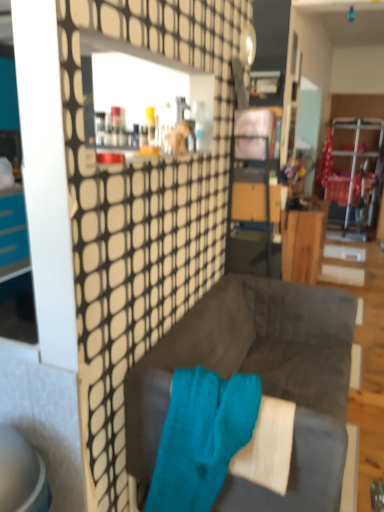
Question: Does point (332, 403) appear closer or farther from the camera than point (288, 215)?

Choices:
 (A) closer
 (B) farther

Answer: (A)

Question: In terms of height, does velvet dark gray couch at center look taller or shorter compared to wooden desk at center?

Choices:
 (A) short
 (B) tall

Answer: (A)

Question: Which object is positioned closest to the teal soft towel at center?

Choices:
 (A) velvet dark gray couch at center
 (B) wooden desk at center

Answer: (A)

Question: Which of these objects is positioned farthest from the teal soft towel at center?

Choices:
 (A) velvet dark gray couch at center
 (B) wooden desk at center

Answer: (B)